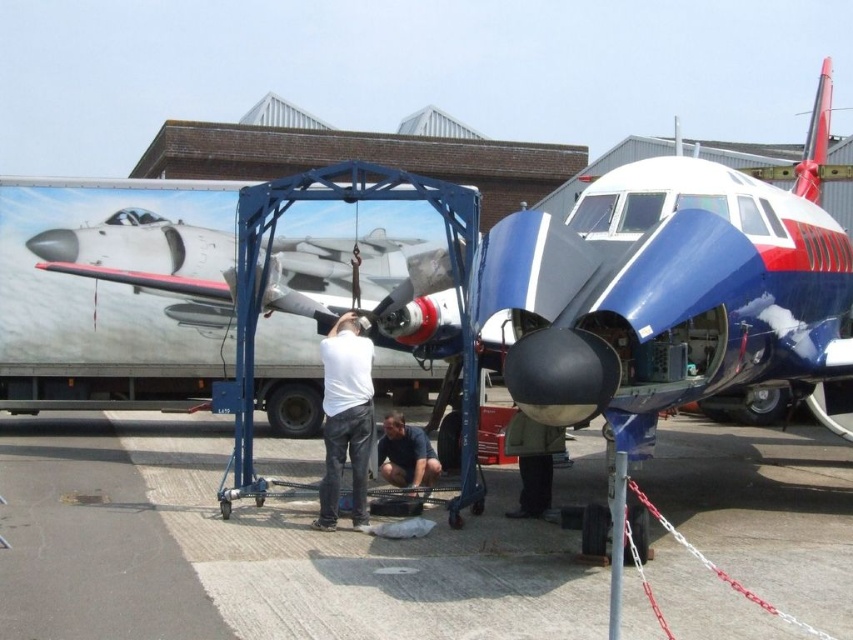
Which is more to the right, white matte shirt at center or dark blue jeans at lower center?

dark blue jeans at lower center is more to the right.

Identify the location of white matte shirt at center. This screenshot has width=853, height=640. (345, 417).

The image size is (853, 640). I want to click on white matte shirt at center, so click(x=345, y=417).

Which of these two, gray asphalt at center or dark green jacket at center, stands taller?

Standing taller between the two is dark green jacket at center.

Is gray asphalt at center positioned at the back of dark green jacket at center?

No, gray asphalt at center is in front of dark green jacket at center.

Where is `gray asphalt at center`? gray asphalt at center is located at coordinates (251, 550).

Is dark green jacket at center to the left of dark blue jeans at lower center from the viewer's perspective?

No, dark green jacket at center is not to the left of dark blue jeans at lower center.

Which is behind, point (543, 433) or point (398, 438)?

The point (398, 438) is behind.

Where is `dark green jacket at center`? dark green jacket at center is located at coordinates (532, 461).